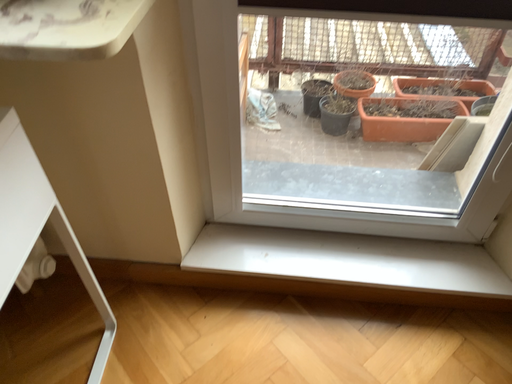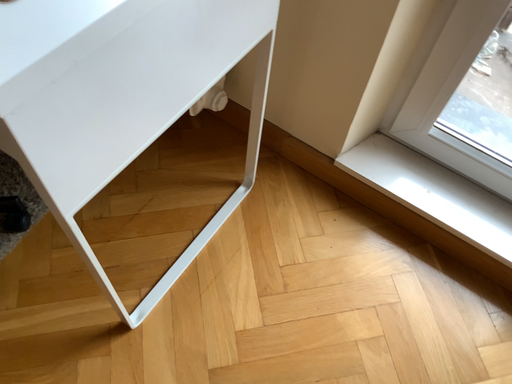
Question: How did the camera likely rotate when shooting the video?

Choices:
 (A) rotated upward
 (B) rotated downward

Answer: (B)